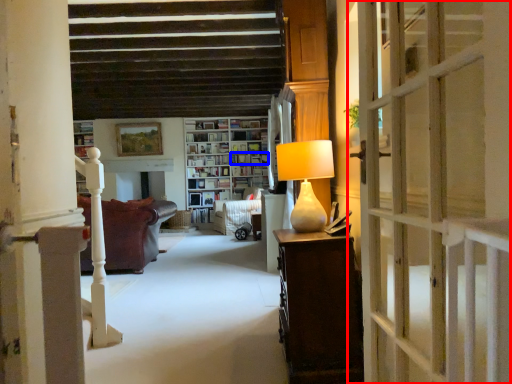
Question: Which of the following is the farthest to the observer, door (highlighted by a red box) or shelf (highlighted by a blue box)?

Choices:
 (A) door
 (B) shelf

Answer: (B)